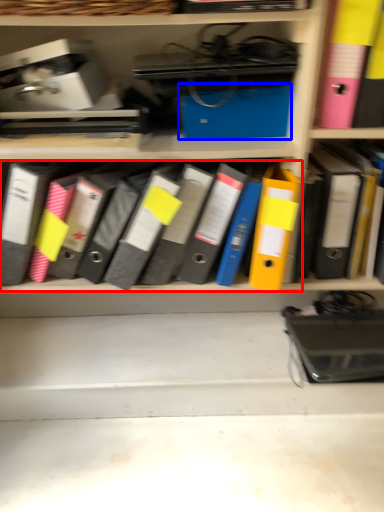
Question: Among these objects, which one is nearest to the camera, notebook (highlighted by a red box) or paperback book (highlighted by a blue box)?

Choices:
 (A) notebook
 (B) paperback book

Answer: (A)